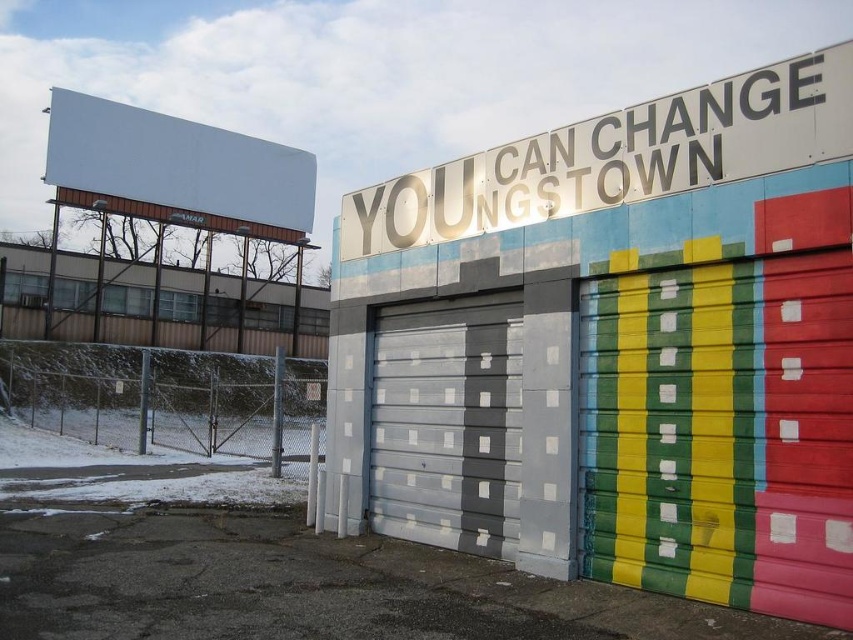
From the picture: Can you confirm if metallic silver sign at upper center is taller than gray matte garage door at center?

No, metallic silver sign at upper center is not taller than gray matte garage door at center.

Who is more forward, (698, 184) or (399, 484)?

Point (698, 184) is more forward.

Where is `metallic silver sign at upper center`? The image size is (853, 640). metallic silver sign at upper center is located at coordinates (618, 157).